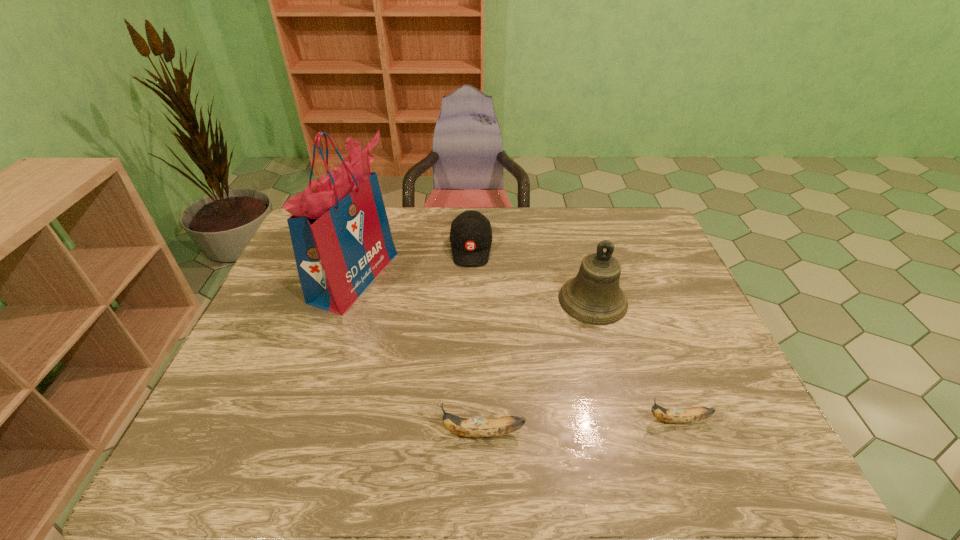
Locate an element on the screen. Image resolution: width=960 pixels, height=540 pixels. blank space located 0.290m at the stem of the taller banana is located at coordinates (305, 433).

Where is `vacant point located at the stem of the taller banana`? The width and height of the screenshot is (960, 540). vacant point located at the stem of the taller banana is located at coordinates 277,433.

I want to click on free region located at the stem of the taller banana, so click(x=395, y=433).

The width and height of the screenshot is (960, 540). In order to click on free space located on the peel of the shorter banana in this screenshot , I will do `click(622, 420)`.

The height and width of the screenshot is (540, 960). I want to click on free space located on the peel of the shorter banana, so click(x=582, y=420).

Where is `free space located on the peel of the shorter banana`? Image resolution: width=960 pixels, height=540 pixels. free space located on the peel of the shorter banana is located at coordinates (595, 420).

In order to click on grocery bag that is positioned at the far edge in this screenshot , I will do `click(340, 233)`.

At what (x,y) coordinates should I click in order to perform the action: click on baseball cap located in the far edge section of the desktop. Please return your answer as a coordinate pair (x, y). This screenshot has width=960, height=540. Looking at the image, I should click on (471, 234).

Find the location of a particular element. Image resolution: width=960 pixels, height=540 pixels. object that is at the near edge is located at coordinates (467, 427).

At what (x,y) coordinates should I click in order to perform the action: click on object positioned at the left edge. Please return your answer as a coordinate pair (x, y). The width and height of the screenshot is (960, 540). Looking at the image, I should click on (340, 233).